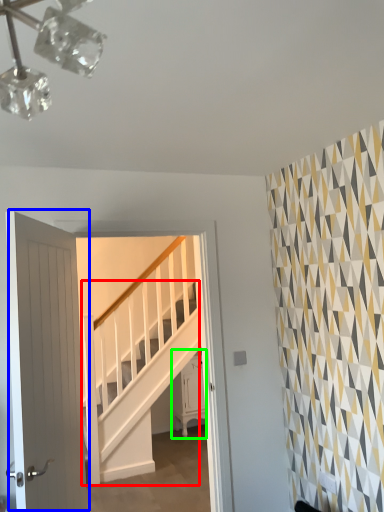
Question: Which object is the closest to the stairs (highlighted by a red box)? Choose among these: door (highlighted by a blue box) or furniture (highlighted by a green box).

Choices:
 (A) door
 (B) furniture

Answer: (B)